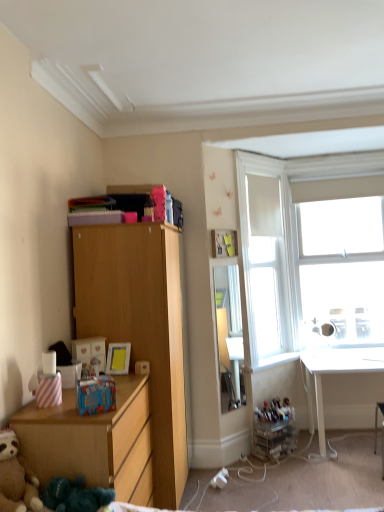
I want to click on vacant location behind white plastic power outlet at lower center, so click(x=225, y=478).